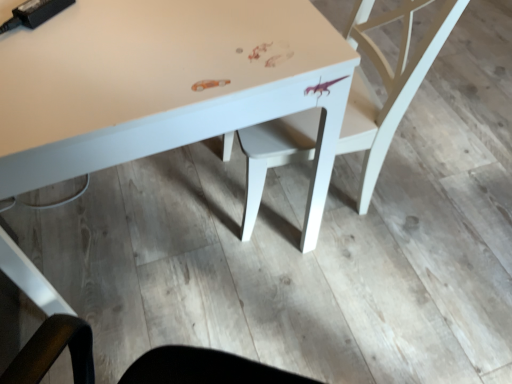
Question: From the image's perspective, is white matte chair at center above or below matte white table at center?

Choices:
 (A) below
 (B) above

Answer: (A)

Question: Relative to matte white table at center, is white matte chair at center in front or behind?

Choices:
 (A) front
 (B) behind

Answer: (B)

Question: Is white matte chair at center bigger or smaller than matte white table at center?

Choices:
 (A) small
 (B) big

Answer: (A)

Question: Which is correct: matte white table at center is inside white matte chair at center, or outside of it?

Choices:
 (A) outside
 (B) inside

Answer: (A)

Question: Visually, is matte white table at center positioned to the left or to the right of white matte chair at center?

Choices:
 (A) right
 (B) left

Answer: (B)

Question: In terms of size, does matte white table at center appear bigger or smaller than white matte chair at center?

Choices:
 (A) small
 (B) big

Answer: (B)

Question: Considering their positions, is matte white table at center located in front of or behind white matte chair at center?

Choices:
 (A) front
 (B) behind

Answer: (A)